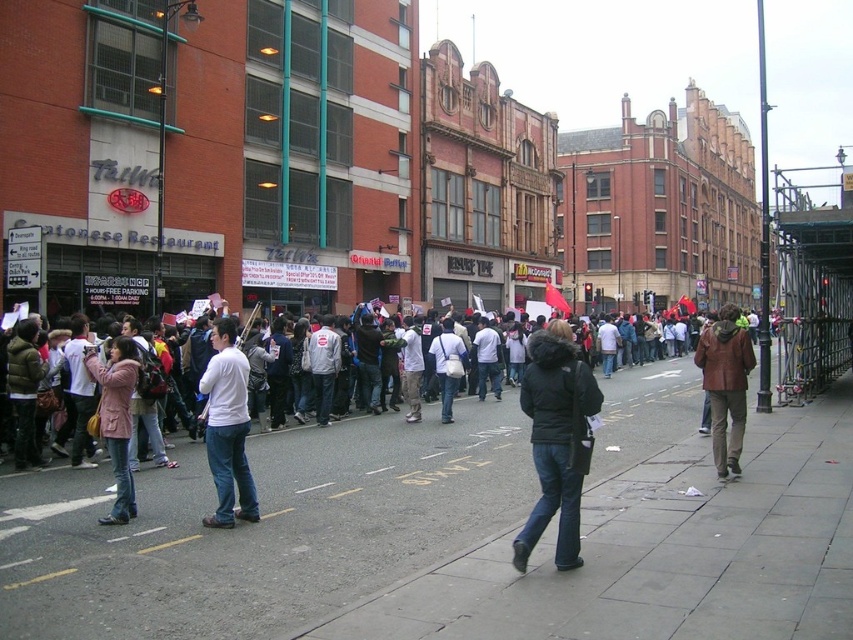
Is white matte shirt at center bigger than matte pink coat at lower left?

Incorrect, white matte shirt at center is not larger than matte pink coat at lower left.

Describe the element at coordinates (227, 428) in the screenshot. I see `white matte shirt at center` at that location.

What are the coordinates of `white matte shirt at center` in the screenshot? It's located at (227, 428).

Describe the element at coordinates (259, 531) in the screenshot. I see `gray concrete sidewalk at lower center` at that location.

Consider the image. Can you confirm if gray concrete sidewalk at lower center is positioned to the right of white fabric bag at center?

Yes, gray concrete sidewalk at lower center is to the right of white fabric bag at center.

Is point (328, 474) positioned before point (450, 337)?

Yes.

You are a GUI agent. You are given a task and a screenshot of the screen. Output one action in this format:
    pyautogui.click(x=<x>, y=<y>)
    Task: Click on the gray concrete sidewalk at lower center
    
    Given the screenshot: What is the action you would take?
    pyautogui.click(x=259, y=531)

Who is shorter, brown leather jacket at right or matte pink coat at lower left?

matte pink coat at lower left is shorter.

Is point (712, 337) closer to viewer compared to point (125, 480)?

No, it is behind (125, 480).

Is point (717, 388) closer to viewer compared to point (117, 403)?

No.

Identify the location of brown leather jacket at right. Image resolution: width=853 pixels, height=640 pixels. (724, 385).